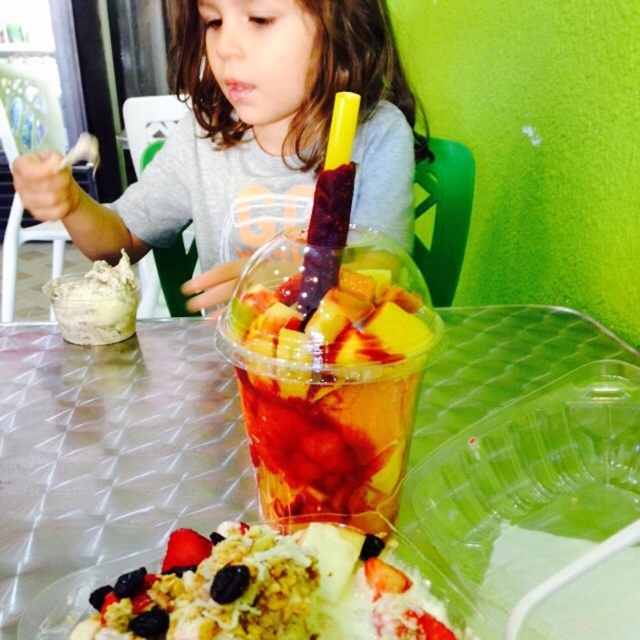
Between point (388, 438) and point (209, 541), which one is positioned in front?

Point (209, 541) is in front.

Is translucent plastic cup at center to the right of shiny granola topped with sliced fruits at center from the viewer's perspective?

Indeed, translucent plastic cup at center is positioned on the right side of shiny granola topped with sliced fruits at center.

Who is more distant from viewer, (300, 504) or (346, 621)?

Point (300, 504)

I want to click on translucent plastic cup at center, so click(x=330, y=397).

Which is more to the left, matte gray shirt at upper left or translucent plastic cup at center?

matte gray shirt at upper left

Locate an element on the screen. This screenshot has height=640, width=640. matte gray shirt at upper left is located at coordinates (252, 138).

At what (x,y) coordinates should I click in order to perform the action: click on matte gray shirt at upper left. Please return your answer as a coordinate pair (x, y). The image size is (640, 640). Looking at the image, I should click on (252, 138).

Identify the location of matte gray shirt at upper left. (252, 138).

Does clear plastic table at center have a larger size compared to translucent plastic cup at center?

Correct, clear plastic table at center is larger in size than translucent plastic cup at center.

Can you confirm if clear plastic table at center is taller than translucent plastic cup at center?

Indeed, clear plastic table at center has a greater height compared to translucent plastic cup at center.

Between point (140, 403) and point (259, 291), which one is positioned in front?

Point (259, 291)

Locate an element on the screen. clear plastic table at center is located at coordinates (109, 449).